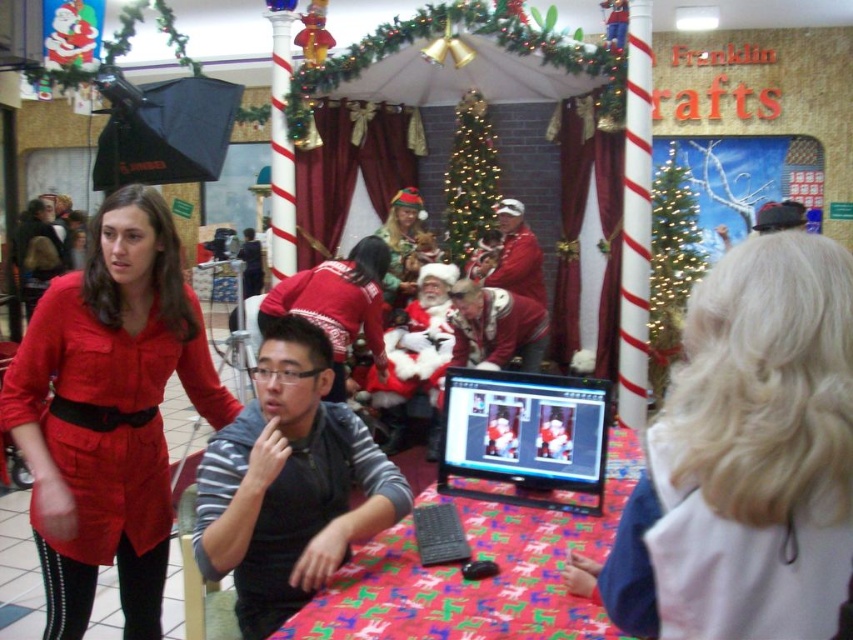
You are standing in the festive indoor setting and see the point at coordinates (289, 483). What object is located at this point?

The point at coordinates (289, 483) is located on the gray fabric vest at center.

You are a photographer setting up for a Christmas photo shoot. You need to position a camera on the table so that it faces the sweater. According to the scene, where should you place the camera relative to the red glossy table at center and the sweater at center?

The red glossy table at center is located below the sweater at center, so you should place the camera on the red glossy table at center facing upwards toward the sweater at center.

You are organizing a Christmas event and need to place a gift box between the matte black monitor at center and the sweater at center. What is the minimum length of the gift box required to fit between them?

The distance between the matte black monitor at center and the sweater at center is 1.80 meters, so the gift box must be at least 1.80 meters long to fit between them.